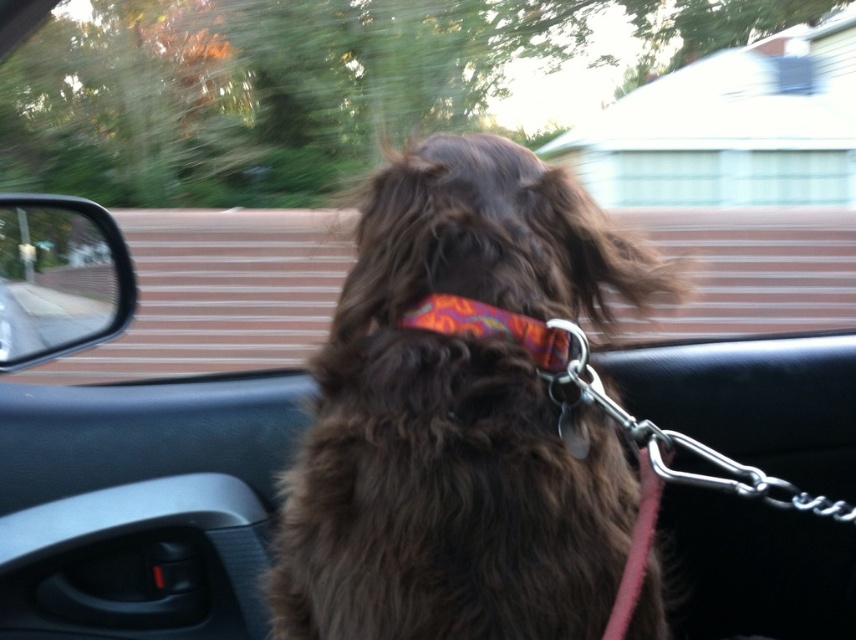
Question: Is brown furry dog at center smaller than clear glass window at upper left?

Choices:
 (A) no
 (B) yes

Answer: (A)

Question: Which point appears closest to the camera in this image?

Choices:
 (A) (40, 308)
 (B) (437, 147)
 (C) (492, 307)

Answer: (C)

Question: Which object is positioned farthest from the clear glass window at upper left?

Choices:
 (A) brown furry dog at center
 (B) multicolored fabric neckband at center

Answer: (B)

Question: Can you confirm if brown furry dog at center is positioned above multicolored fabric neckband at center?

Choices:
 (A) yes
 (B) no

Answer: (B)

Question: Estimate the real-world distances between objects in this image. Which object is farther from the multicolored fabric neckband at center?

Choices:
 (A) clear glass window at upper left
 (B) brown furry dog at center

Answer: (A)

Question: Can you confirm if brown furry dog at center is smaller than clear glass window at upper left?

Choices:
 (A) no
 (B) yes

Answer: (A)